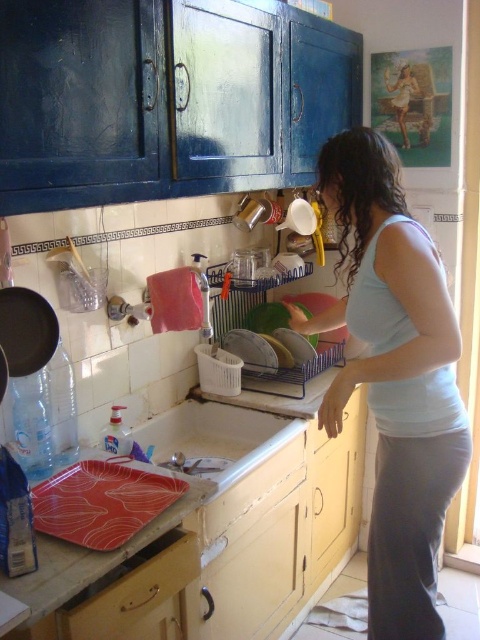
Question: Which point is closer to the camera?

Choices:
 (A) (262, 460)
 (B) (387, 291)

Answer: (B)

Question: Can you confirm if white glossy counter top at sink is positioned above white glossy sink at lower center?

Choices:
 (A) no
 (B) yes

Answer: (A)

Question: Is light blue tank top at center smaller than white glossy sink at lower center?

Choices:
 (A) yes
 (B) no

Answer: (B)

Question: Where is white glossy counter top at sink located in relation to light blue tank top at center in the image?

Choices:
 (A) left
 (B) right

Answer: (A)

Question: Which object is the closest to the white glossy counter top at sink?

Choices:
 (A) light blue tank top at center
 (B) white glossy sink at lower center

Answer: (B)

Question: Which point is closer to the camera?

Choices:
 (A) light blue tank top at center
 (B) white glossy counter top at sink
 (C) white glossy sink at lower center

Answer: (B)